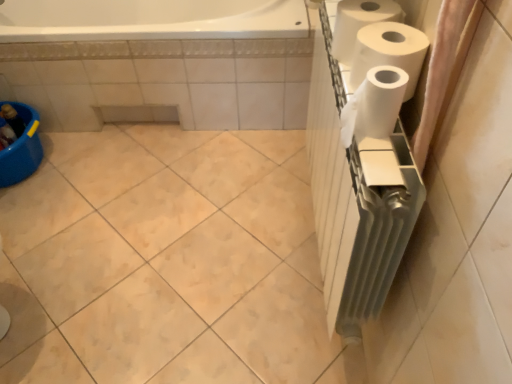
Question: Is white matte paper towel at upper right, the first paper towel in the back-to-front sequence, taller or shorter than pink fabric shower curtain at right?

Choices:
 (A) short
 (B) tall

Answer: (A)

Question: Is white matte paper towel at upper right, the first paper towel in the back-to-front sequence, inside the boundaries of pink fabric shower curtain at right, or outside?

Choices:
 (A) inside
 (B) outside

Answer: (B)

Question: Which object is the closest to the white matte paper towel at right, which is the first paper towel in front-to-back order?

Choices:
 (A) white matte paper towel at upper right, placed as the third paper towel when sorted from front to back
 (B) pink fabric shower curtain at right
 (C) white matte paper towel at right, the second paper towel in the back-to-front sequence

Answer: (C)

Question: Estimate the real-world distances between objects in this image. Which object is closer to the pink fabric shower curtain at right?

Choices:
 (A) white matte paper towel at right, the second paper towel in the back-to-front sequence
 (B) white matte paper towel at right, the third paper towel when ordered from back to front
 (C) white matte paper towel at upper right, placed as the third paper towel when sorted from front to back

Answer: (B)